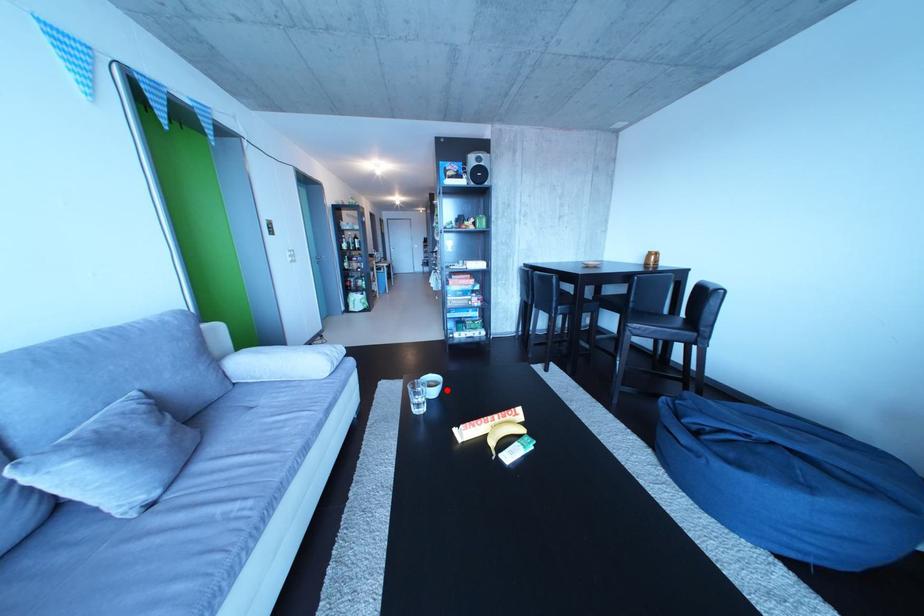
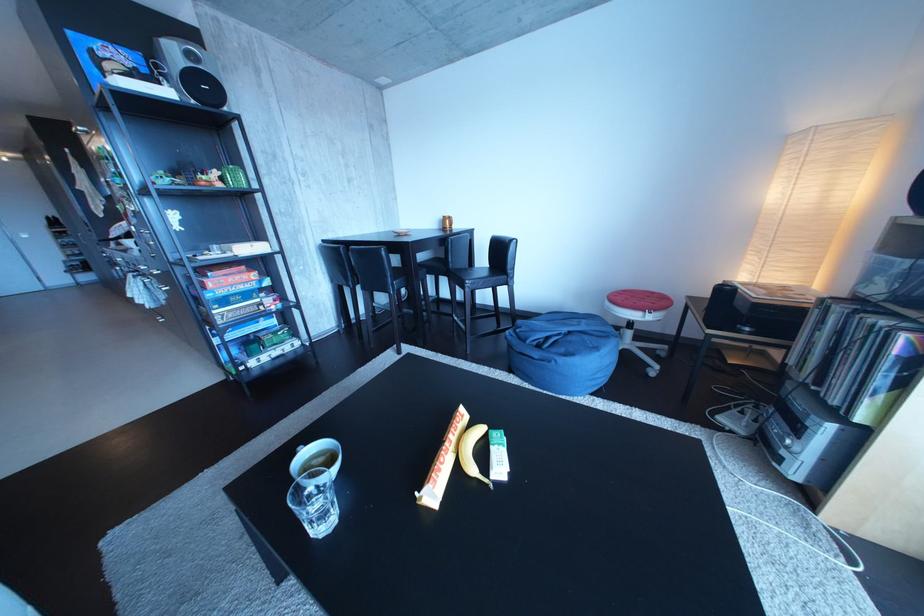
In the second image, find the point that corresponds to the highlighted location in the first image.

(334, 466)